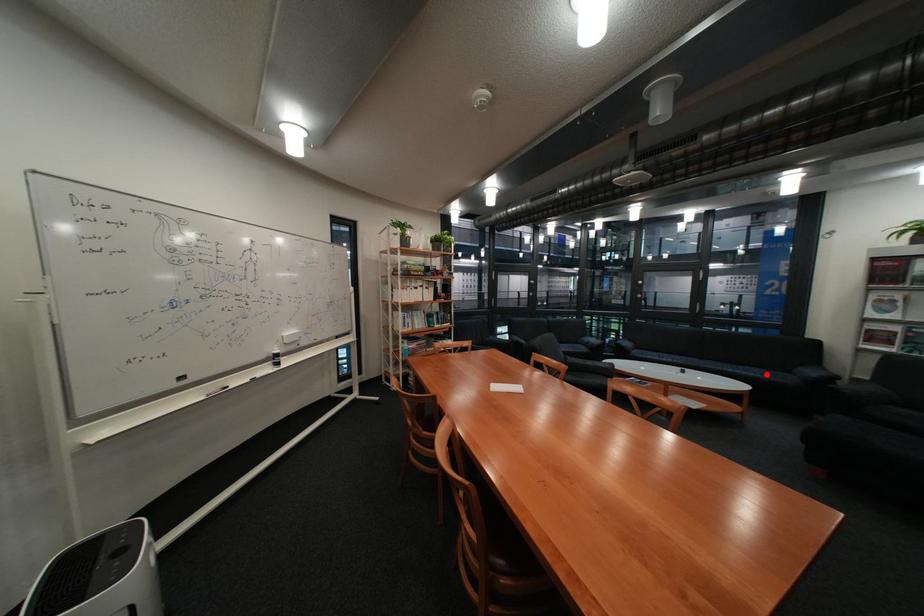
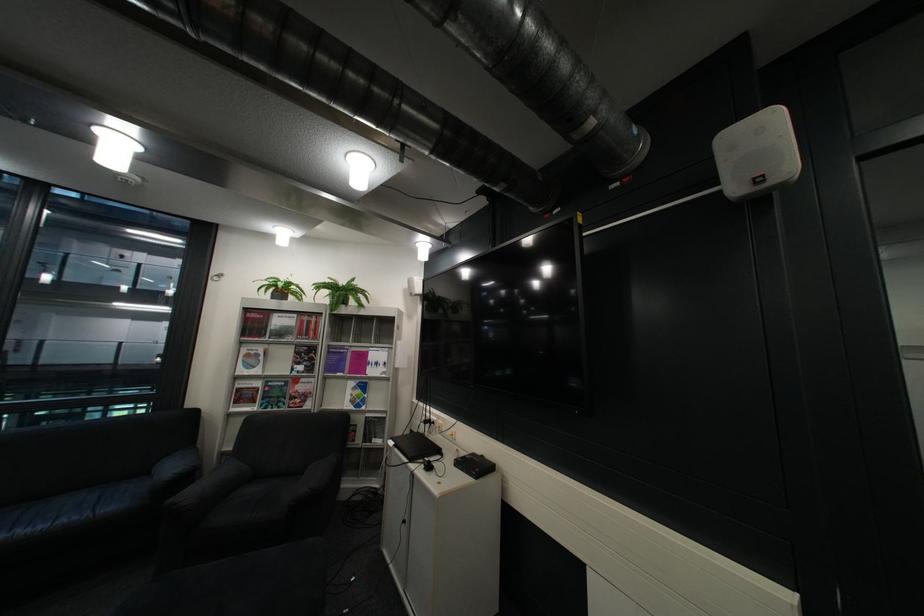
Question: I am providing you with two images of the same scene from different viewpoints. Image1 has a red point marked. In image2, the corresponding 3D location appears at what relative position? Reply with the corresponding letter.

Choices:
 (A) Closer
 (B) Farther

Answer: (A)